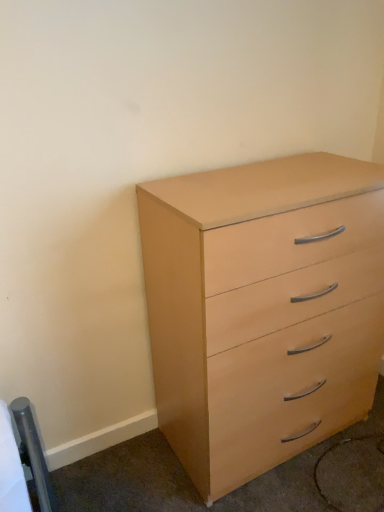
Question: Should I look upward or downward to see light wood chest of drawers at right?

Choices:
 (A) up
 (B) down

Answer: (B)